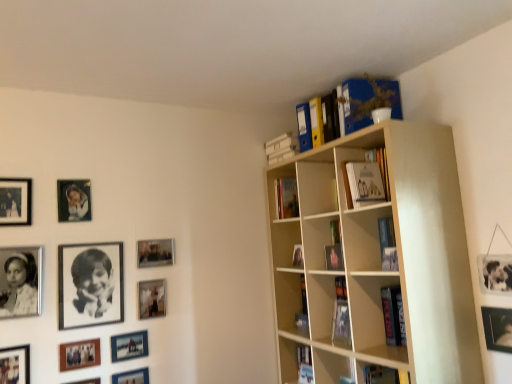
The height and width of the screenshot is (384, 512). Describe the element at coordinates (79, 354) in the screenshot. I see `wooden photo frame at lower left, which ranks as the eighth picture frame in right-to-left order` at that location.

Describe the element at coordinates (73, 200) in the screenshot. The image size is (512, 384). I see `matte black photo frame at upper left, positioned as the 9th picture frame in right-to-left order` at that location.

Measure the distance between black matte photo frame at lower left, which is the 11th picture frame from right to left, and camera.

The depth of black matte photo frame at lower left, which is the 11th picture frame from right to left, is 6.23 feet.

This screenshot has height=384, width=512. I want to click on metallic silver picture frame at upper right, acting as the first picture frame starting from the right, so click(x=497, y=328).

Where is `beige wood bookcase at upper right`? Image resolution: width=512 pixels, height=384 pixels. beige wood bookcase at upper right is located at coordinates (378, 259).

Describe the element at coordinates (358, 105) in the screenshot. The width and height of the screenshot is (512, 384). I see `blue cardboard file at upper right` at that location.

I want to click on metallic silver photo frame at lower left, placed as the 9th picture frame when sorted from left to right, so click(132, 377).

In the scene shown: Is metallic silver picture frame at upper right, which ranks as the 12th picture frame in left-to-right order, at the left side of black matte photo frame at lower left, which ranks as the second picture frame in left-to-right order?

No.

Where is `the 3rd picture frame directly beneath the black matte photo frame at lower left, which is the 11th picture frame from right to left (from a real-world perspective)`? The image size is (512, 384). the 3rd picture frame directly beneath the black matte photo frame at lower left, which is the 11th picture frame from right to left (from a real-world perspective) is located at coordinates (497, 328).

Looking at this image, can you confirm if metallic silver picture frame at upper right, which ranks as the 12th picture frame in left-to-right order, is smaller than black matte photo frame at lower left, which ranks as the second picture frame in left-to-right order?

Indeed, metallic silver picture frame at upper right, which ranks as the 12th picture frame in left-to-right order, has a smaller size compared to black matte photo frame at lower left, which ranks as the second picture frame in left-to-right order.

Is point (493, 314) closer or farther from the camera than point (7, 256)?

Clearly, point (493, 314) is closer to the camera than point (7, 256).

From a real-world perspective, relative to metallic silver picture frame at upper right, which ranks as the 12th picture frame in left-to-right order, is matte black photo frame at upper left, which appears as the fourth picture frame when viewed from the left, vertically above or below?

From a real-world perspective, matte black photo frame at upper left, which appears as the fourth picture frame when viewed from the left, is physically above metallic silver picture frame at upper right, which ranks as the 12th picture frame in left-to-right order.

Is matte black photo frame at upper left, positioned as the 9th picture frame in right-to-left order, oriented towards metallic silver picture frame at upper right, which ranks as the 12th picture frame in left-to-right order?

No, matte black photo frame at upper left, positioned as the 9th picture frame in right-to-left order, is not aimed at metallic silver picture frame at upper right, which ranks as the 12th picture frame in left-to-right order.

In the scene shown: Is matte black photo frame at upper left, which appears as the fourth picture frame when viewed from the left, shorter than metallic silver picture frame at upper right, acting as the first picture frame starting from the right?

Incorrect, the height of matte black photo frame at upper left, which appears as the fourth picture frame when viewed from the left, does not fall short of that of metallic silver picture frame at upper right, acting as the first picture frame starting from the right.

Between matte black picture frame at center-left, the eleventh picture frame viewed from the left, and metallic silver photo frame at lower left, acting as the 8th picture frame starting from the left, which one has larger width?

With larger width is matte black picture frame at center-left, the eleventh picture frame viewed from the left.

Who is more distant, matte black picture frame at center-left, the 2th picture frame viewed from the right, or metallic silver photo frame at lower left, marked as the fifth picture frame in a right-to-left arrangement?

matte black picture frame at center-left, the 2th picture frame viewed from the right, is further away from the camera.

Which point is more distant from viewer, (153, 247) or (140, 340)?

The point (153, 247) is behind.

From the image's perspective, is matte black picture frame at center-left, the 2th picture frame viewed from the right, positioned above or below metallic silver photo frame at lower left, acting as the 8th picture frame starting from the left?

matte black picture frame at center-left, the 2th picture frame viewed from the right, is situated higher than metallic silver photo frame at lower left, acting as the 8th picture frame starting from the left, in the image.

From a real-world perspective, which object rests below the other?

From a 3D spatial view, black matte photo frame at lower left, which is the 11th picture frame from right to left, is below.

Which of these two, blue cardboard file at upper right or black matte photo frame at lower left, which is the 11th picture frame from right to left, is bigger?

With larger size is blue cardboard file at upper right.

From the image's perspective, would you say blue cardboard file at upper right is shown under black matte photo frame at lower left, which ranks as the second picture frame in left-to-right order?

No.

Could you measure the distance between blue cardboard file at upper right and black matte photo frame at lower left, which is the 11th picture frame from right to left?

blue cardboard file at upper right is 1.65 meters from black matte photo frame at lower left, which is the 11th picture frame from right to left.

Measure the distance from metallic silver photo frame at lower left, marked as the fifth picture frame in a right-to-left arrangement, to matte black picture frame at lower left, which is the 7th picture frame in right-to-left order.

metallic silver photo frame at lower left, marked as the fifth picture frame in a right-to-left arrangement, and matte black picture frame at lower left, which is the 7th picture frame in right-to-left order, are 7.44 inches apart from each other.

Where is `the 2nd picture frame below the metallic silver photo frame at lower left, acting as the 8th picture frame starting from the left (from the image's perspective)`? This screenshot has width=512, height=384. the 2nd picture frame below the metallic silver photo frame at lower left, acting as the 8th picture frame starting from the left (from the image's perspective) is located at coordinates (86, 381).

From a real-world perspective, which is physically above, metallic silver photo frame at lower left, marked as the fifth picture frame in a right-to-left arrangement, or matte black picture frame at lower left, which is the 7th picture frame in right-to-left order?

metallic silver photo frame at lower left, marked as the fifth picture frame in a right-to-left arrangement, is physically above.

From the image's perspective, is metallic silver photo frame at lower left, marked as the fifth picture frame in a right-to-left arrangement, located above or below matte black picture frame at lower left, acting as the 6th picture frame starting from the left?

metallic silver photo frame at lower left, marked as the fifth picture frame in a right-to-left arrangement, is above matte black picture frame at lower left, acting as the 6th picture frame starting from the left.

How much distance is there between black matte photo frame at lower left, which is the 11th picture frame from right to left, and matte black picture frame at lower left, which is counted as the 10th picture frame, starting from the right?

black matte photo frame at lower left, which is the 11th picture frame from right to left, and matte black picture frame at lower left, which is counted as the 10th picture frame, starting from the right, are 26.56 centimeters apart.

Between point (17, 299) and point (3, 360), which one is positioned behind?

Positioned behind is point (17, 299).

Which of these two, black matte photo frame at lower left, which is the 11th picture frame from right to left, or matte black picture frame at lower left, which is counted as the 10th picture frame, starting from the right, is smaller?

matte black picture frame at lower left, which is counted as the 10th picture frame, starting from the right, is smaller.

Is matte silver picture frame at center-left, which ranks as the 3th picture frame in right-to-left order, positioned far away from matte black photo frame at upper left, positioned as the 9th picture frame in right-to-left order?

They are positioned close to each other.

Who is smaller, matte silver picture frame at center-left, the 10th picture frame when ordered from left to right, or matte black photo frame at upper left, which appears as the fourth picture frame when viewed from the left?

matte silver picture frame at center-left, the 10th picture frame when ordered from left to right.

Is matte silver picture frame at center-left, which ranks as the 3th picture frame in right-to-left order, shorter than matte black photo frame at upper left, which appears as the fourth picture frame when viewed from the left?

Yes, matte silver picture frame at center-left, which ranks as the 3th picture frame in right-to-left order, is shorter than matte black photo frame at upper left, which appears as the fourth picture frame when viewed from the left.

Identify the location of the 10th picture frame counting from the left side of the metallic silver picture frame at upper right, which ranks as the 12th picture frame in left-to-right order. This screenshot has width=512, height=384. (20, 282).

In order to click on picture frame that is the 6th one below the matte black photo frame at upper left, which appears as the fourth picture frame when viewed from the left (from a real-world perspective) in this screenshot , I will do point(497,328).

Considering their positions, is metallic silver picture frame at upper right, which ranks as the 12th picture frame in left-to-right order, positioned further to matte silver picture frame at center-left, which ranks as the 3th picture frame in right-to-left order, than black matte photo frame at lower left, which is the 11th picture frame from right to left?

metallic silver picture frame at upper right, which ranks as the 12th picture frame in left-to-right order, is further to matte silver picture frame at center-left, which ranks as the 3th picture frame in right-to-left order.

Estimate the real-world distances between objects in this image. Which object is further from matte black picture frame at lower left, acting as the 6th picture frame starting from the left, black paper at upper left, which is counted as the 7th picture frame, starting from the left, or beige wood bookcase at upper right?

beige wood bookcase at upper right is further to matte black picture frame at lower left, acting as the 6th picture frame starting from the left.

Looking at the image, which one is located further to matte black picture frame at center-left, the 2th picture frame viewed from the right, matte black picture frame at lower left, which is counted as the 10th picture frame, starting from the right, or beige wood bookcase at upper right?

beige wood bookcase at upper right lies further to matte black picture frame at center-left, the 2th picture frame viewed from the right, than the other object.

Based on their spatial positions, is beige wood bookcase at upper right or matte black picture frame at center-left, the eleventh picture frame viewed from the left, closer to matte black picture frame at lower left, positioned as the 3th picture frame in left-to-right order?

Based on the image, matte black picture frame at center-left, the eleventh picture frame viewed from the left, appears to be nearer to matte black picture frame at lower left, positioned as the 3th picture frame in left-to-right order.

Estimate the real-world distances between objects in this image. Which object is closer to matte black picture frame at lower left, acting as the 6th picture frame starting from the left, metallic silver photo frame at lower left, acting as the 8th picture frame starting from the left, or black matte photo frame at lower left, which is the 11th picture frame from right to left?

metallic silver photo frame at lower left, acting as the 8th picture frame starting from the left, lies closer to matte black picture frame at lower left, acting as the 6th picture frame starting from the left, than the other object.

From the image, which object appears to be nearer to matte black photo frame at upper left, positioned as the 9th picture frame in right-to-left order, matte black picture frame at lower left, which is counted as the 10th picture frame, starting from the right, or wooden photo frame at lower left, marked as the 5th picture frame in a left-to-right arrangement?

wooden photo frame at lower left, marked as the 5th picture frame in a left-to-right arrangement, lies closer to matte black photo frame at upper left, positioned as the 9th picture frame in right-to-left order, than the other object.

Estimate the real-world distances between objects in this image. Which object is further from metallic silver photo frame at lower left, marked as the fifth picture frame in a right-to-left arrangement, matte black photo frame at upper left, which appears as the fourth picture frame when viewed from the left, or metallic silver photo frame at lower left, marked as the fourth picture frame in a right-to-left arrangement?

matte black photo frame at upper left, which appears as the fourth picture frame when viewed from the left.

Based on their spatial positions, is metallic silver picture frame at upper right, which ranks as the 12th picture frame in left-to-right order, or beige wood bookcase at upper right closer to black paper at upper left, the 6th picture frame from the right?

beige wood bookcase at upper right.

Locate an element on the screen. The width and height of the screenshot is (512, 384). bookcase between black paper at upper left, which is counted as the 7th picture frame, starting from the left, and metallic silver picture frame at upper right, which ranks as the 12th picture frame in left-to-right order, in the horizontal direction is located at coordinates (378, 259).

Locate an element on the screen. The width and height of the screenshot is (512, 384). book between matte black picture frame at upper left, marked as the 1th picture frame in a left-to-right arrangement, and metallic silver picture frame at upper right, which ranks as the 12th picture frame in left-to-right order, from left to right is located at coordinates (358, 105).

Image resolution: width=512 pixels, height=384 pixels. What are the coordinates of `book located between matte black picture frame at lower left, positioned as the 3th picture frame in left-to-right order, and metallic silver picture frame at upper right, which ranks as the 12th picture frame in left-to-right order, in the left-right direction` in the screenshot? It's located at (358, 105).

Where is `bookcase situated between matte black picture frame at lower left, acting as the 6th picture frame starting from the left, and blue cardboard file at upper right from left to right`? Image resolution: width=512 pixels, height=384 pixels. bookcase situated between matte black picture frame at lower left, acting as the 6th picture frame starting from the left, and blue cardboard file at upper right from left to right is located at coordinates tap(378, 259).